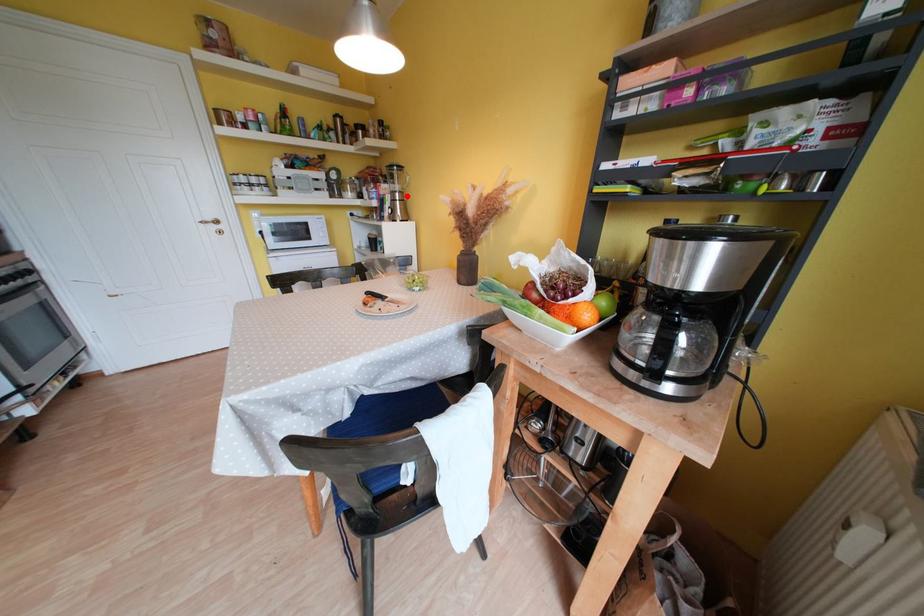
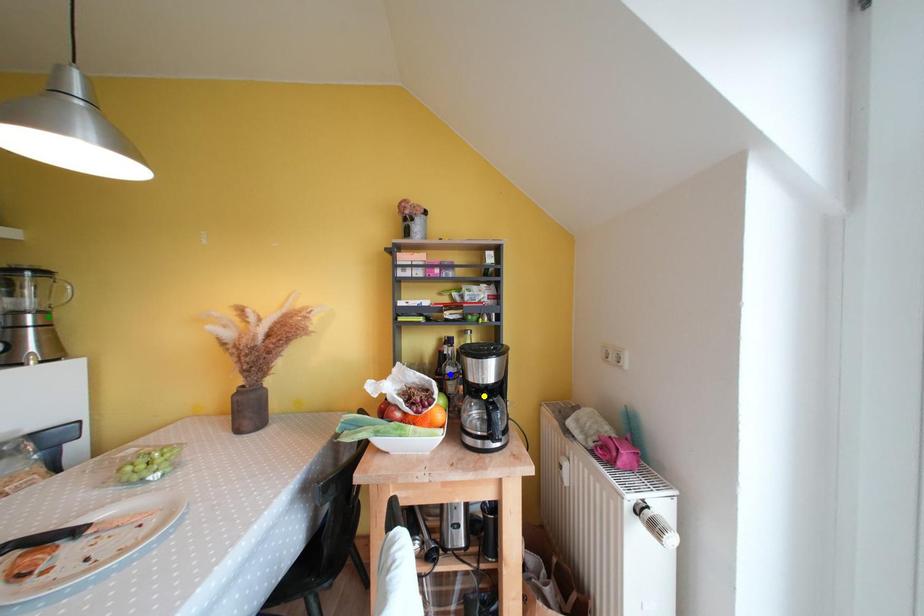
Question: I am providing you with two images of the same scene from different viewpoints. A red point is marked on the first image. You are given multiple points on the second image. Which point in image 2 represents the same 3d spot as the red point in image 1?

Choices:
 (A) yellow point
 (B) blue point
 (C) green point

Answer: (C)